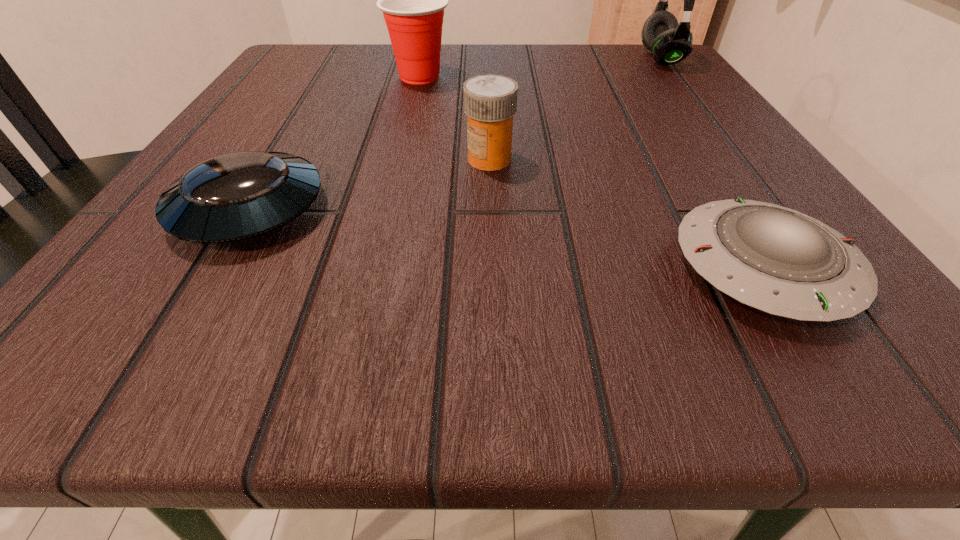
Where is `object situated at the near edge`? object situated at the near edge is located at coordinates (777, 260).

At what (x,y) coordinates should I click in order to perform the action: click on object present at the left edge. Please return your answer as a coordinate pair (x, y). Looking at the image, I should click on (235, 196).

I want to click on headset present at the right edge, so click(670, 42).

This screenshot has width=960, height=540. What are the coordinates of `saucer present at the right edge` in the screenshot? It's located at (777, 260).

Locate an element on the screen. object at the far right corner is located at coordinates (670, 42).

The image size is (960, 540). What are the coordinates of `object located at the near right corner` in the screenshot? It's located at (777, 260).

You are a GUI agent. You are given a task and a screenshot of the screen. Output one action in this format:
    pyautogui.click(x=<x>, y=<y>)
    Task: Click on the free region at the far edge of the desktop
    The image size is (960, 540).
    Given the screenshot: What is the action you would take?
    pyautogui.click(x=481, y=42)

This screenshot has height=540, width=960. In the image, there is a desktop. What are the coordinates of `free space at the near edge` in the screenshot? It's located at (241, 370).

At what (x,y) coordinates should I click in order to perform the action: click on vacant space at the right edge of the desktop. Please return your answer as a coordinate pair (x, y). Looking at the image, I should click on pos(678,226).

This screenshot has width=960, height=540. I want to click on vacant space at the far left corner of the desktop, so click(319, 60).